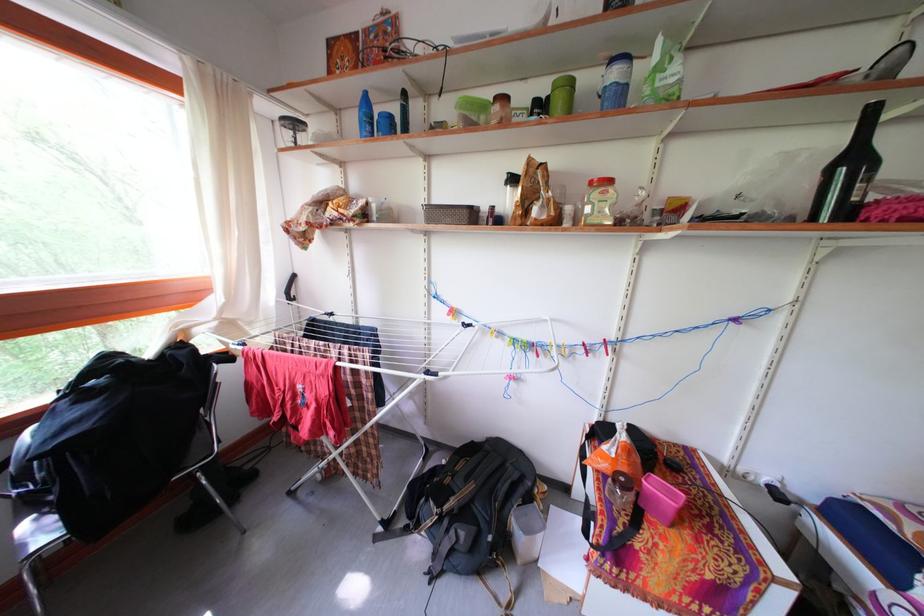
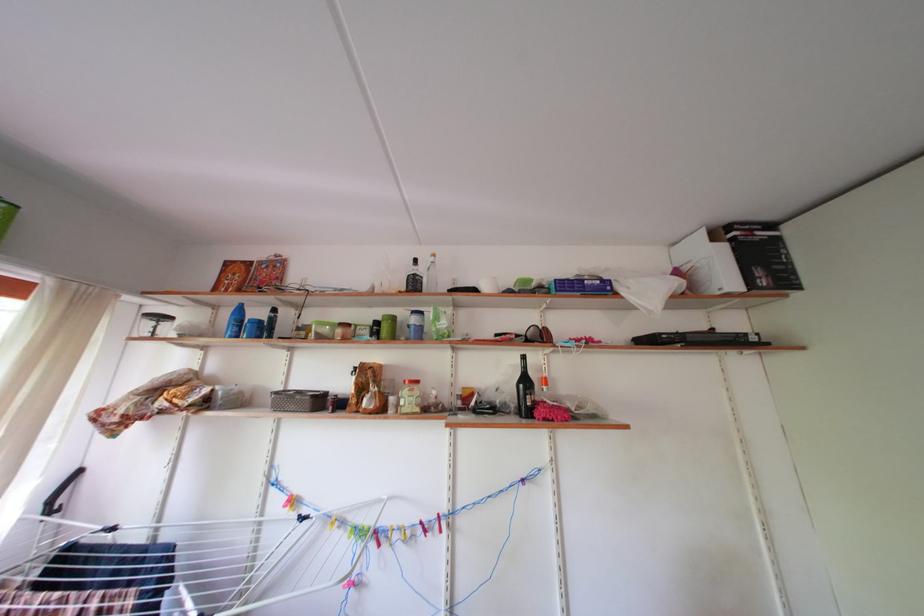
Where in the second image is the point corresponding to pixel 505 344 from the first image?

(346, 535)